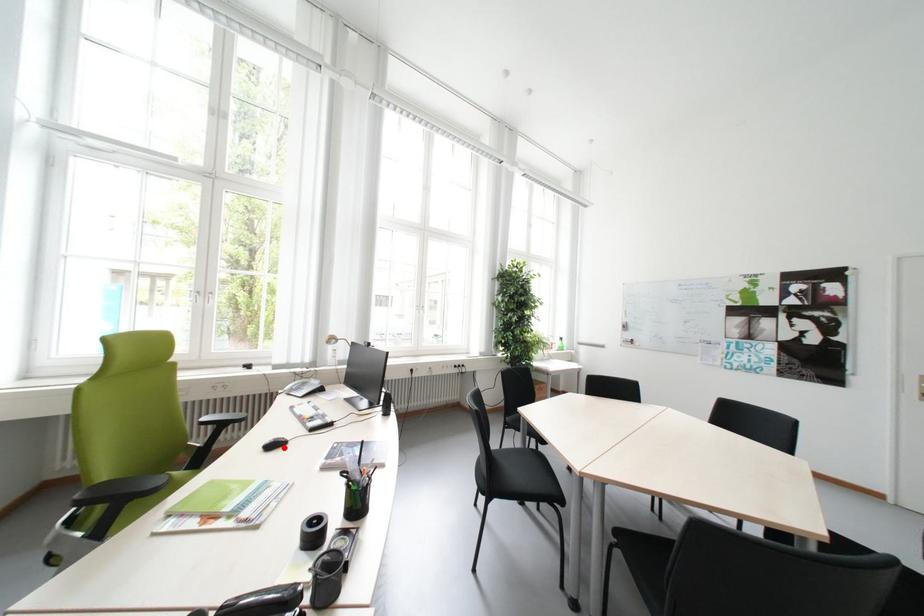
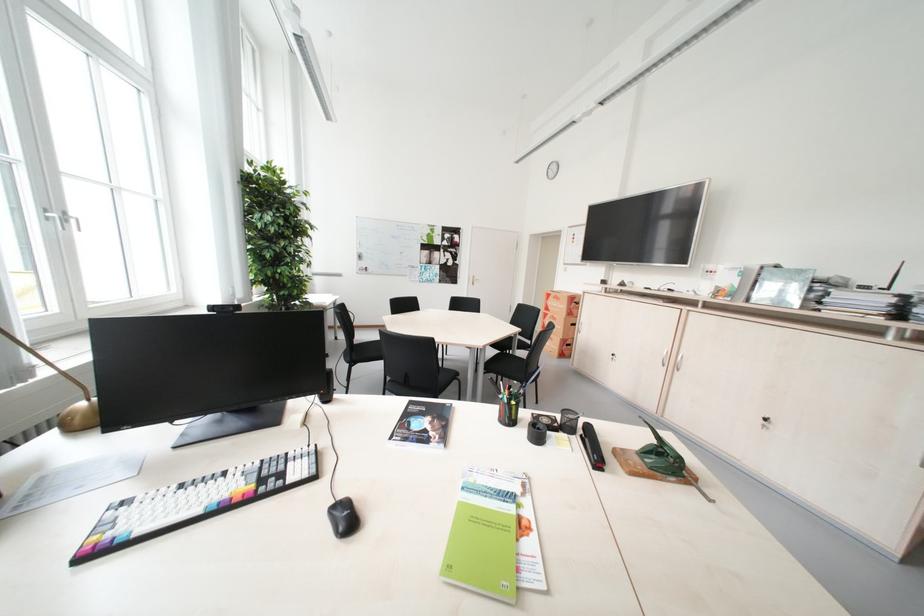
Find the pixel in the second image that matches the highlighted location in the first image.

(359, 521)